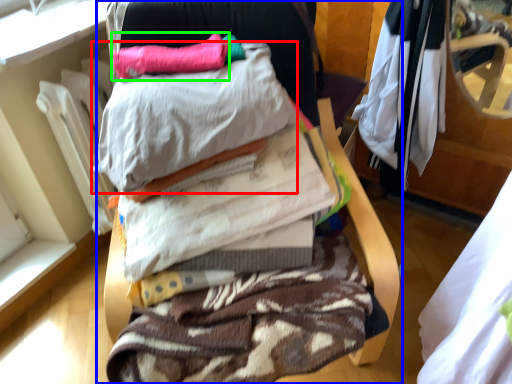
Question: Based on their relative distances, which object is farther from pillow (highlighted by a red box)? Choose from furniture (highlighted by a blue box) and pillow (highlighted by a green box).

Choices:
 (A) furniture
 (B) pillow

Answer: (A)